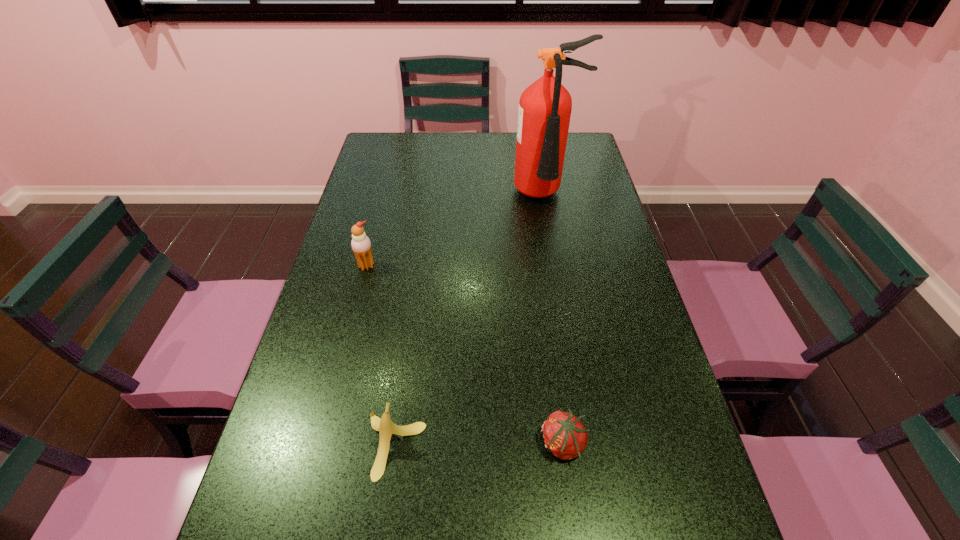
Find the location of a particular element. Image resolution: width=960 pixels, height=540 pixels. vacant point located between the tallest object and the tomato is located at coordinates (554, 320).

Find the location of a particular element. This screenshot has width=960, height=540. free space between the tomato and the banana is located at coordinates (479, 444).

Where is `blank region between the third tallest object and the tallest object`? The image size is (960, 540). blank region between the third tallest object and the tallest object is located at coordinates (470, 321).

The height and width of the screenshot is (540, 960). In order to click on vacant region between the fire extinguisher and the third shortest object in this screenshot , I will do `click(456, 231)`.

Locate an element on the screen. The width and height of the screenshot is (960, 540). free spot between the farthest object and the tomato is located at coordinates (554, 320).

What are the coordinates of `free spot between the fire extinguisher and the leftmost object` in the screenshot? It's located at (456, 231).

In order to click on vacant region between the second farthest object and the tomato in this screenshot , I will do `click(465, 355)`.

Identify the location of the closest object to the tallest object. The width and height of the screenshot is (960, 540). (361, 245).

Select which object is the third closest to the banana. Please provide its 2D coordinates. Your answer should be formatted as a tuple, i.e. [(x, y)], where the tuple contains the x and y coordinates of a point satisfying the conditions above.

[(545, 107)]

This screenshot has width=960, height=540. Identify the location of vacant region that satisfies the following two spatial constraints: 1. at the front with a straw on the third tallest object; 2. on the left side of the second farthest object. (321, 446).